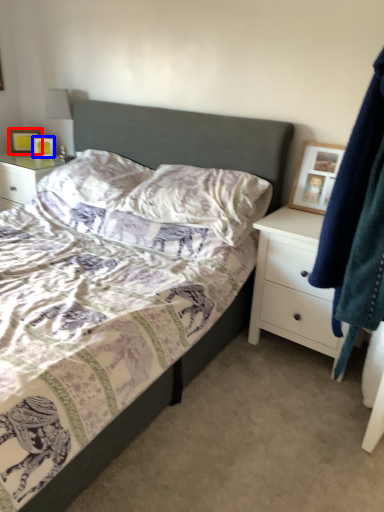
Question: Which object is further to the camera taking this photo, picture frame (highlighted by a red box) or picture frame (highlighted by a blue box)?

Choices:
 (A) picture frame
 (B) picture frame

Answer: (A)